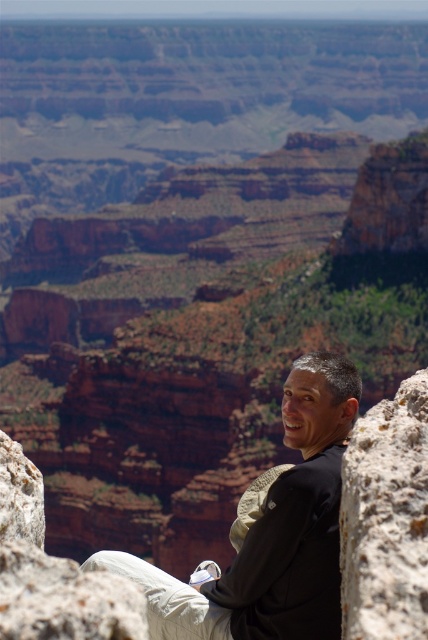
Question: Is matte black shirt at center below rusty rock at right?

Choices:
 (A) no
 (B) yes

Answer: (B)

Question: Which point appears closest to the camera in this image?

Choices:
 (A) (380, 634)
 (B) (157, 602)

Answer: (A)

Question: Is matte black shirt at center smaller than rusty rock at right?

Choices:
 (A) no
 (B) yes

Answer: (A)

Question: Can you confirm if matte black shirt at center is smaller than rusty rock at right?

Choices:
 (A) yes
 (B) no

Answer: (B)